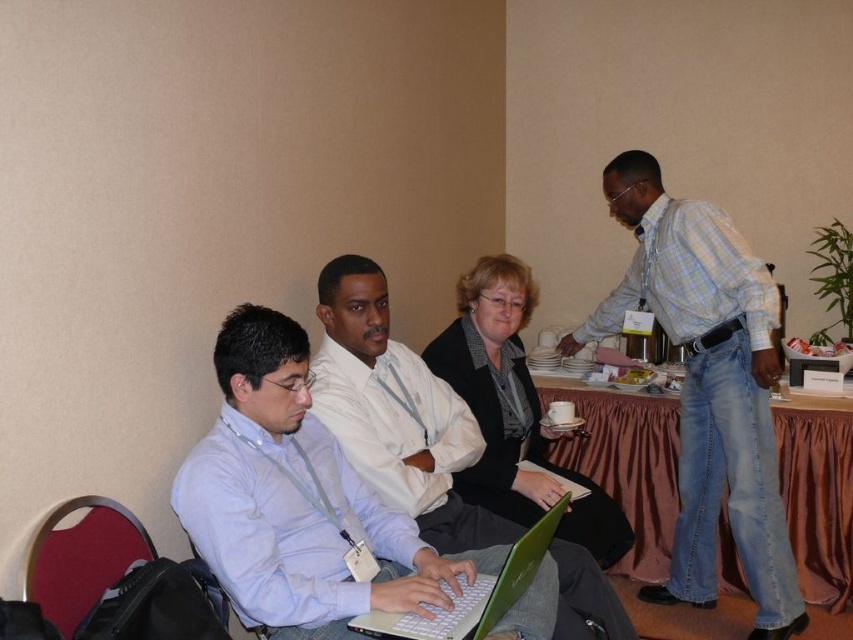
You are attending a meeting in this room and need to place a document on the brown fabric table at center and the green matte laptop at center. Which object is located to the right when viewed from the front?

The brown fabric table at center is positioned on the right side of the green matte laptop at center, so when viewed from the front, the brown fabric table at center is to the right of the green matte laptop at center.

You are sitting in the velvet red chair at lower left and want to place your coffee mug on the green matte laptop at center. Can you reach it without moving from your current position?

The velvet red chair at lower left is in front of the green matte laptop at center, so you are sitting directly in front of it. If the laptop is on a table or surface within arm reach, you might be able to place the mug. However, since the laptop is at center and you are in front of it, your arms would need to extend forward to reach. Without knowing the exact distance, it is uncertain if you can reach without moving.

You are a photographer standing in the room and want to take a photo of the white shirt at center and the green matte laptop at center. Which object will appear larger in the photo?

The white shirt at center will appear larger in the photo because it is much taller than the green matte laptop at center.